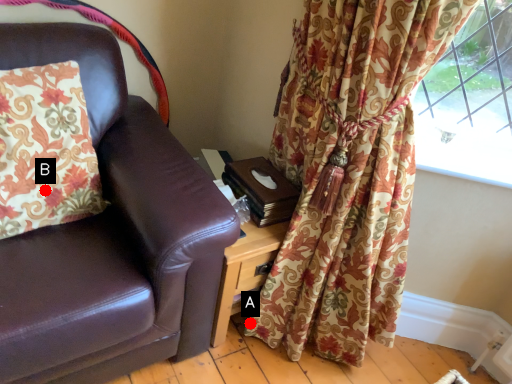
Question: Two points are circled on the image, labeled by A and B beside each circle. Which point is closer to the camera?

Choices:
 (A) A is closer
 (B) B is closer

Answer: (B)